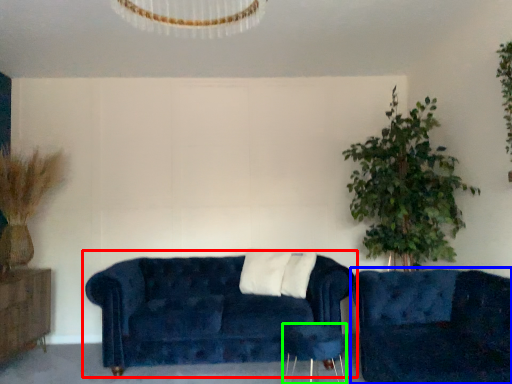
Question: Which is nearer to the studio couch (highlighted by a red box)? studio couch (highlighted by a blue box) or side table (highlighted by a green box).

Choices:
 (A) studio couch
 (B) side table

Answer: (B)